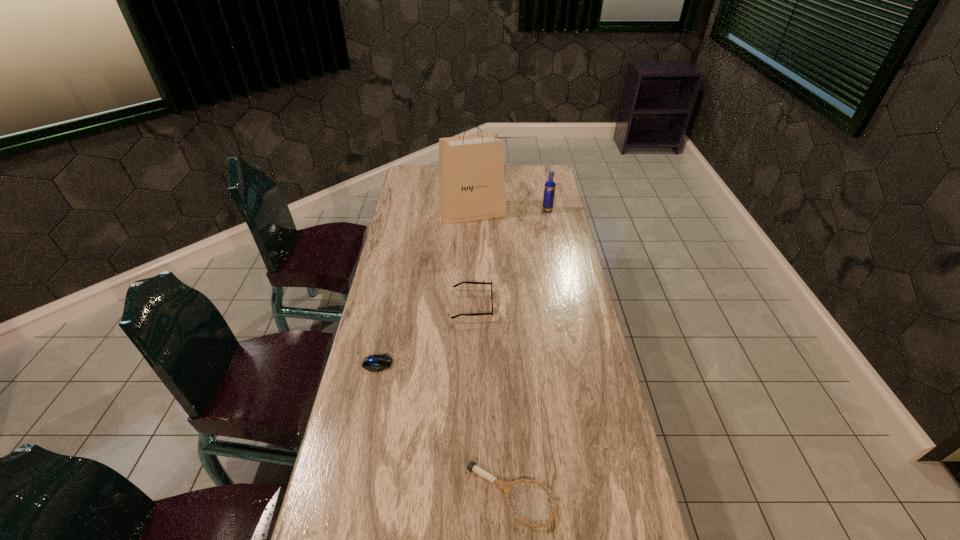
Identify the location of free space located 0.170m on the front-facing side of the third nearest object. (541, 305).

This screenshot has width=960, height=540. What are the coordinates of `free space located on the right of the tennis racket` in the screenshot? It's located at (586, 495).

Where is `vacant space located 0.330m on the button side of the leftmost object`? The height and width of the screenshot is (540, 960). vacant space located 0.330m on the button side of the leftmost object is located at coordinates (501, 364).

Find the location of a particular element. Image resolution: width=960 pixels, height=540 pixels. object that is at the left edge is located at coordinates (374, 363).

Image resolution: width=960 pixels, height=540 pixels. Find the location of `object at the right edge`. object at the right edge is located at coordinates (549, 189).

Image resolution: width=960 pixels, height=540 pixels. I want to click on free space at the far edge, so click(x=512, y=175).

Find the location of `vacant space at the left edge`. vacant space at the left edge is located at coordinates (398, 350).

Identify the location of free region at the right edge. (570, 357).

Identify the location of free space at the far right corner of the desktop. (529, 188).

Where is `blank region between the sunglasses and the nearest object`? blank region between the sunglasses and the nearest object is located at coordinates (492, 400).